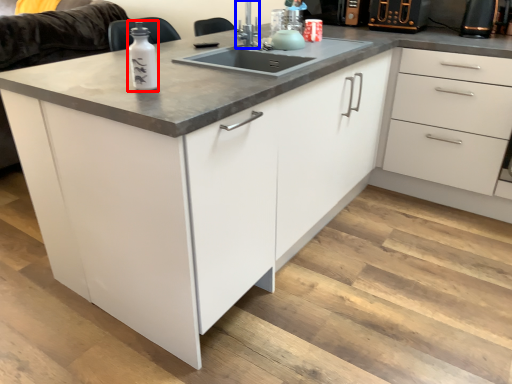
Question: Which of the following is the farthest to the observer, bottle (highlighted by a red box) or faucet (highlighted by a blue box)?

Choices:
 (A) bottle
 (B) faucet

Answer: (B)